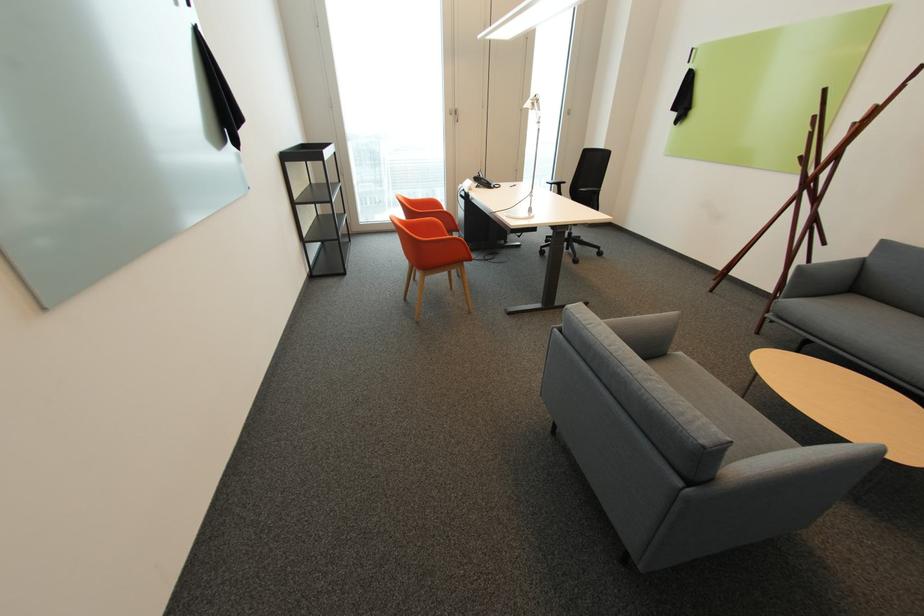
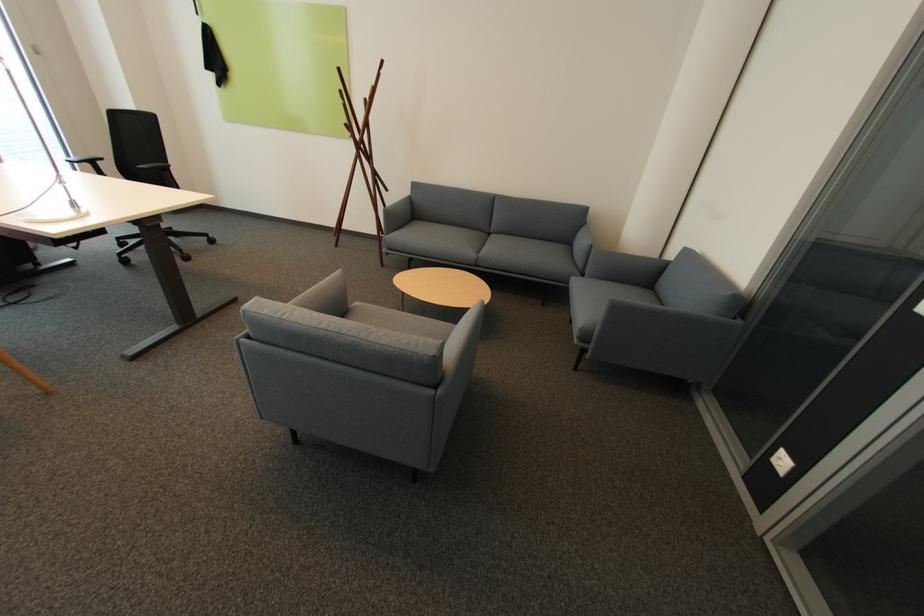
Where in the second image is the point corresponding to point 809,159 from the first image?

(355, 126)